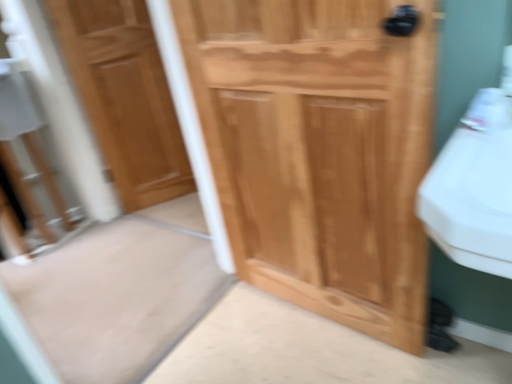
Where is `natural wood cabinet at center, which ranks as the 2th door in back-to-front order`? The width and height of the screenshot is (512, 384). natural wood cabinet at center, which ranks as the 2th door in back-to-front order is located at coordinates (319, 151).

What do you see at coordinates (319, 151) in the screenshot? I see `natural wood cabinet at center, which is the first door in right-to-left order` at bounding box center [319, 151].

The width and height of the screenshot is (512, 384). What do you see at coordinates (125, 97) in the screenshot? I see `light brown wood door at left, the 2th door when ordered from front to back` at bounding box center [125, 97].

The height and width of the screenshot is (384, 512). I want to click on light brown wood door at left, marked as the second door in a right-to-left arrangement, so click(125, 97).

Find the location of a particular element. The height and width of the screenshot is (384, 512). natural wood cabinet at center, the second door when ordered from left to right is located at coordinates (319, 151).

Consider the image. Between natural wood cabinet at center, which is the first door in right-to-left order, and light brown wood door at left, acting as the 1th door starting from the left, which one appears on the left side from the viewer's perspective?

From the viewer's perspective, light brown wood door at left, acting as the 1th door starting from the left, appears more on the left side.

Which object is further away from the camera taking this photo, natural wood cabinet at center, arranged as the 1th door when viewed from the front, or light brown wood door at left, the 2th door when ordered from front to back?

light brown wood door at left, the 2th door when ordered from front to back.

Which is closer, (369, 204) or (132, 107)?

Point (369, 204)

From the image's perspective, is natural wood cabinet at center, which is the first door in right-to-left order, on light brown wood door at left, acting as the 1th door starting from the left?

No, from the image's perspective, natural wood cabinet at center, which is the first door in right-to-left order, is not on top of light brown wood door at left, acting as the 1th door starting from the left.

From a real-world perspective, is natural wood cabinet at center, the second door when ordered from left to right, positioned above or below light brown wood door at left, marked as the second door in a right-to-left arrangement?

Clearly, from a real-world perspective, natural wood cabinet at center, the second door when ordered from left to right, is below light brown wood door at left, marked as the second door in a right-to-left arrangement.

Is natural wood cabinet at center, arranged as the 1th door when viewed from the front, thinner than light brown wood door at left, acting as the 1th door starting from the left?

In fact, natural wood cabinet at center, arranged as the 1th door when viewed from the front, might be wider than light brown wood door at left, acting as the 1th door starting from the left.

Is natural wood cabinet at center, arranged as the 1th door when viewed from the front, shorter than light brown wood door at left, the 2th door when ordered from front to back?

Yes.

Who is smaller, natural wood cabinet at center, which ranks as the 2th door in back-to-front order, or light brown wood door at left, acting as the 1th door starting from the left?

light brown wood door at left, acting as the 1th door starting from the left.

Would you say natural wood cabinet at center, the second door when ordered from left to right, contains light brown wood door at left, the first door in the back-to-front sequence?

No, natural wood cabinet at center, the second door when ordered from left to right, does not contain light brown wood door at left, the first door in the back-to-front sequence.

Is natural wood cabinet at center, which ranks as the 2th door in back-to-front order, positioned far away from light brown wood door at left, acting as the 1th door starting from the left?

Yes, natural wood cabinet at center, which ranks as the 2th door in back-to-front order, is far from light brown wood door at left, acting as the 1th door starting from the left.

Is natural wood cabinet at center, the second door when ordered from left to right, aimed at light brown wood door at left, the first door in the back-to-front sequence?

No, natural wood cabinet at center, the second door when ordered from left to right, is not turned towards light brown wood door at left, the first door in the back-to-front sequence.

How many degrees apart are the facing directions of natural wood cabinet at center, which is the first door in right-to-left order, and light brown wood door at left, acting as the 1th door starting from the left?

The angular difference between natural wood cabinet at center, which is the first door in right-to-left order, and light brown wood door at left, acting as the 1th door starting from the left, is 59.7 degrees.

How much distance is there between natural wood cabinet at center, which ranks as the 2th door in back-to-front order, and light brown wood door at left, the 2th door when ordered from front to back?

natural wood cabinet at center, which ranks as the 2th door in back-to-front order, is 3.66 feet from light brown wood door at left, the 2th door when ordered from front to back.

You are a GUI agent. You are given a task and a screenshot of the screen. Output one action in this format:
    pyautogui.click(x=<x>, y=<y>)
    Task: Click on the door in front of the light brown wood door at left, acting as the 1th door starting from the left
    This screenshot has height=384, width=512.
    Given the screenshot: What is the action you would take?
    pyautogui.click(x=319, y=151)

Between light brown wood door at left, the first door in the back-to-front sequence, and natural wood cabinet at center, the second door when ordered from left to right, which one appears on the left side from the viewer's perspective?

From the viewer's perspective, light brown wood door at left, the first door in the back-to-front sequence, appears more on the left side.

Considering the positions of objects light brown wood door at left, the 2th door when ordered from front to back, and natural wood cabinet at center, which ranks as the 2th door in back-to-front order, in the image provided, who is in front, light brown wood door at left, the 2th door when ordered from front to back, or natural wood cabinet at center, which ranks as the 2th door in back-to-front order,?

Positioned in front is natural wood cabinet at center, which ranks as the 2th door in back-to-front order.

Does point (155, 90) appear closer or farther from the camera than point (354, 304)?

Clearly, point (155, 90) is more distant from the camera than point (354, 304).

From the image's perspective, is light brown wood door at left, marked as the second door in a right-to-left arrangement, above or below natural wood cabinet at center, which ranks as the 2th door in back-to-front order?

From the image's perspective, light brown wood door at left, marked as the second door in a right-to-left arrangement, appears above natural wood cabinet at center, which ranks as the 2th door in back-to-front order.

In the scene shown: From a real-world perspective, which object stands above the other?

light brown wood door at left, acting as the 1th door starting from the left, is physically above.

Is light brown wood door at left, the first door in the back-to-front sequence, wider or thinner than natural wood cabinet at center, arranged as the 1th door when viewed from the front?

light brown wood door at left, the first door in the back-to-front sequence, is thinner than natural wood cabinet at center, arranged as the 1th door when viewed from the front.

Which of these two, light brown wood door at left, the 2th door when ordered from front to back, or natural wood cabinet at center, which is the first door in right-to-left order, stands shorter?

natural wood cabinet at center, which is the first door in right-to-left order, is shorter.

Can you confirm if light brown wood door at left, marked as the second door in a right-to-left arrangement, is bigger than natural wood cabinet at center, arranged as the 1th door when viewed from the front?

Incorrect, light brown wood door at left, marked as the second door in a right-to-left arrangement, is not larger than natural wood cabinet at center, arranged as the 1th door when viewed from the front.

Is natural wood cabinet at center, the second door when ordered from left to right, inside light brown wood door at left, the 2th door when ordered from front to back?

No, natural wood cabinet at center, the second door when ordered from left to right, is not inside light brown wood door at left, the 2th door when ordered from front to back.

Based on the photo, is light brown wood door at left, the 2th door when ordered from front to back, placed right next to natural wood cabinet at center, arranged as the 1th door when viewed from the front?

light brown wood door at left, the 2th door when ordered from front to back, and natural wood cabinet at center, arranged as the 1th door when viewed from the front, are clearly separated.

Does light brown wood door at left, marked as the second door in a right-to-left arrangement, turn towards natural wood cabinet at center, arranged as the 1th door when viewed from the front?

Yes, light brown wood door at left, marked as the second door in a right-to-left arrangement, is oriented towards natural wood cabinet at center, arranged as the 1th door when viewed from the front.

How different are the orientations of light brown wood door at left, the first door in the back-to-front sequence, and natural wood cabinet at center, the second door when ordered from left to right, in degrees?

They differ by 59.7 degrees in their facing directions.

You are a GUI agent. You are given a task and a screenshot of the screen. Output one action in this format:
    pyautogui.click(x=<x>, y=<y>)
    Task: Click on the door in front of the light brown wood door at left, the 2th door when ordered from front to back
    This screenshot has width=512, height=384.
    Given the screenshot: What is the action you would take?
    pyautogui.click(x=319, y=151)

This screenshot has width=512, height=384. Identify the location of door lying below the light brown wood door at left, the 2th door when ordered from front to back (from the image's perspective). click(319, 151).

Find the location of `door to the left of natural wood cabinet at center, the second door when ordered from left to right`. door to the left of natural wood cabinet at center, the second door when ordered from left to right is located at coordinates (125, 97).